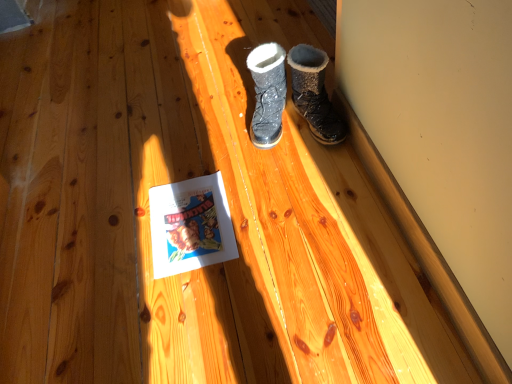
Find the location of a particular element. empty space that is ontop of white paper at center (from a real-world perspective) is located at coordinates (189, 218).